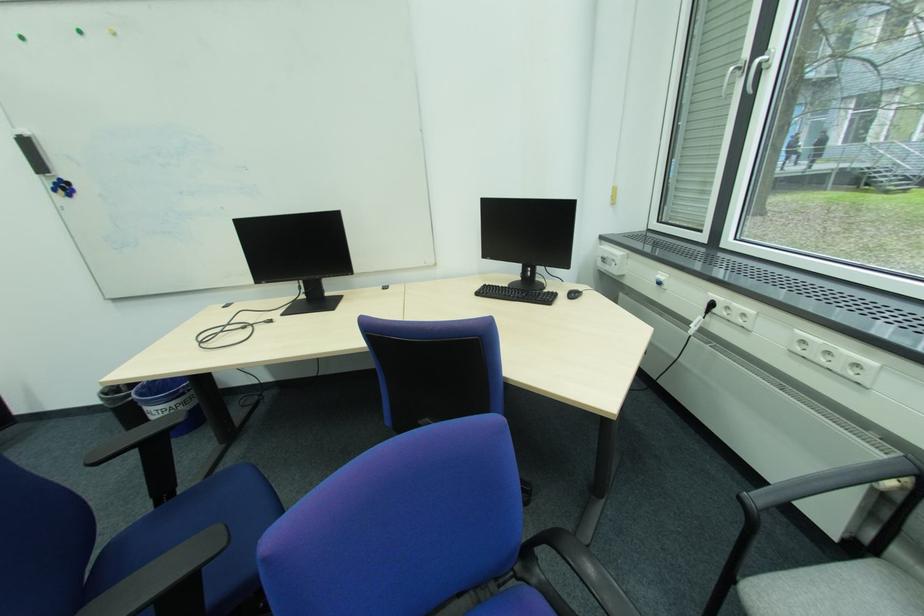
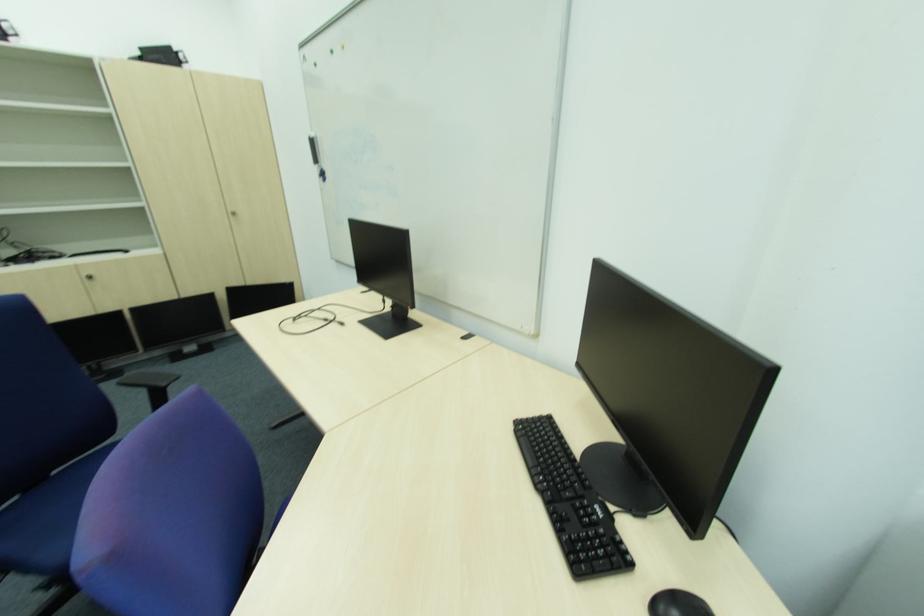
The point at (47, 183) is marked in the first image. Where is the corresponding point in the second image?

(322, 172)